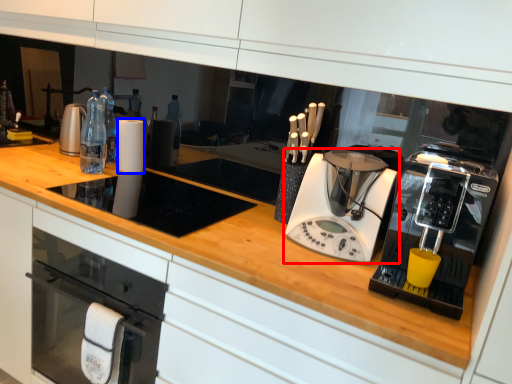
Question: Which object is closer to the camera taking this photo, home appliance (highlighted by a red box) or paper towel (highlighted by a blue box)?

Choices:
 (A) home appliance
 (B) paper towel

Answer: (A)